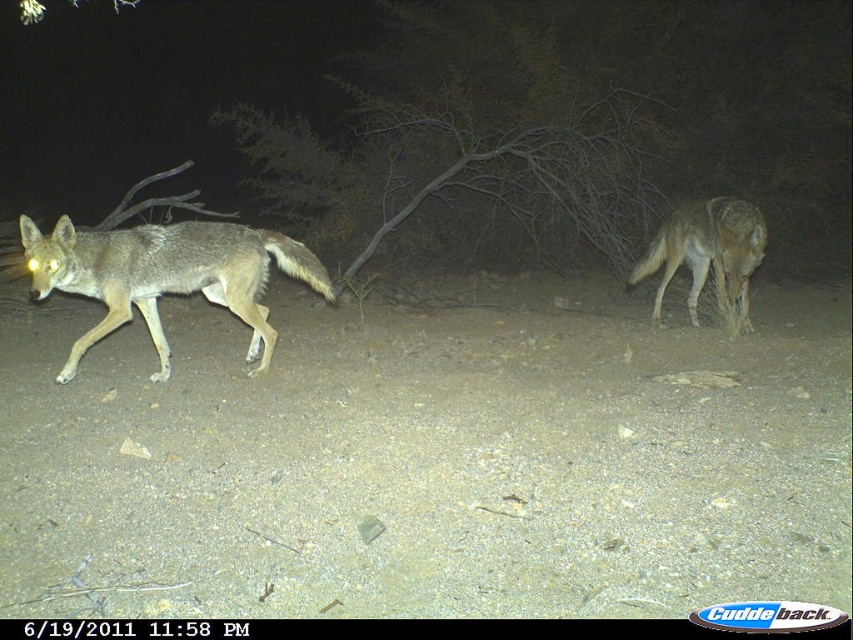
Question: Does furry gray coyote at left have a lesser width compared to brown fur coyote at right?

Choices:
 (A) no
 (B) yes

Answer: (A)

Question: Is the position of furry gray coyote at left more distant than that of brown fur coyote at right?

Choices:
 (A) yes
 (B) no

Answer: (B)

Question: Which point is closer to the camera?

Choices:
 (A) (691, 234)
 (B) (138, 305)

Answer: (B)

Question: Which point is closer to the camera?

Choices:
 (A) (33, 264)
 (B) (688, 212)

Answer: (A)

Question: Among these objects, which one is nearest to the camera?

Choices:
 (A) brown fur coyote at right
 (B) furry gray coyote at left

Answer: (B)

Question: Does furry gray coyote at left appear under brown fur coyote at right?

Choices:
 (A) yes
 (B) no

Answer: (A)